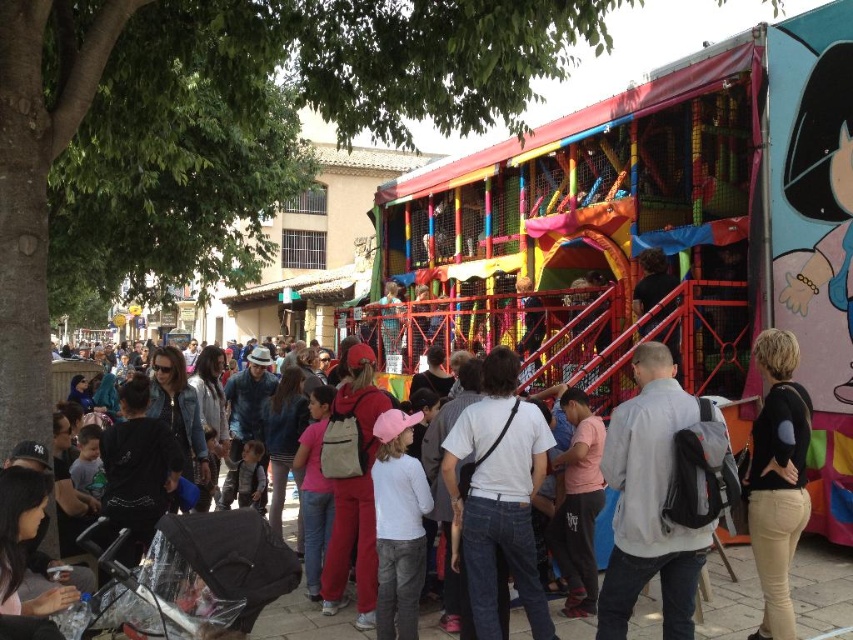
Question: Is multicolored plastic playhouse at center smaller than gray fabric backpack at center?

Choices:
 (A) yes
 (B) no

Answer: (B)

Question: Estimate the real-world distances between objects in this image. Which object is closer to the gray fabric backpack at center?

Choices:
 (A) multicolored plastic playhouse at center
 (B) white cotton shirt at center

Answer: (B)

Question: Does gray fabric backpack at center have a lesser width compared to white matte shirt at center?

Choices:
 (A) no
 (B) yes

Answer: (A)

Question: Is multicolored plastic playhouse at center positioned at the back of white matte shirt at center?

Choices:
 (A) no
 (B) yes

Answer: (B)

Question: Which point is closer to the camera?

Choices:
 (A) [x=807, y=412]
 (B) [x=520, y=525]
 (C) [x=688, y=618]
 (D) [x=637, y=100]

Answer: (C)

Question: Which point is closer to the camera taking this photo?

Choices:
 (A) (461, 557)
 (B) (772, 336)

Answer: (B)